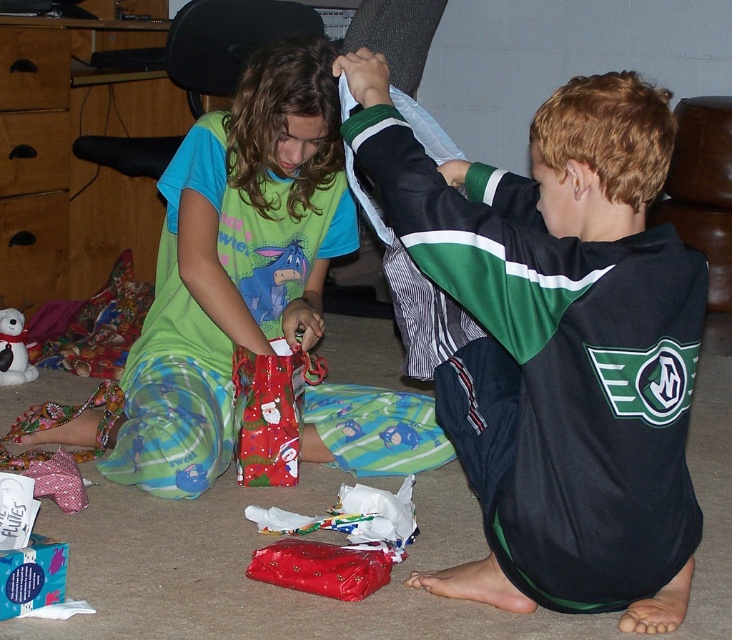
Question: Which is farther from the shiny metallic gift bag at lower left?

Choices:
 (A) dark green jersey at right
 (B) white matte teddy bear at lower left

Answer: (B)

Question: Observing the image, what is the correct spatial positioning of matte green pajama pants at center in reference to shiny red fabric gift bag at lower center?

Choices:
 (A) left
 (B) right

Answer: (A)

Question: Considering the real-world distances, which object is farthest from the dark green jersey at right?

Choices:
 (A) white matte teddy bear at lower left
 (B) shiny metallic gift bag at lower left
 (C) matte green pajama pants at center

Answer: (A)

Question: In this image, where is dark green jersey at right located relative to shiny red fabric gift bag at lower center?

Choices:
 (A) above
 (B) below

Answer: (A)

Question: Estimate the real-world distances between objects in this image. Which object is farther from the shiny red fabric gift bag at lower center?

Choices:
 (A) white matte teddy bear at lower left
 (B) dark green jersey at right

Answer: (A)

Question: Can you confirm if dark green jersey at right is wider than shiny metallic gift bag at lower left?

Choices:
 (A) no
 (B) yes

Answer: (B)